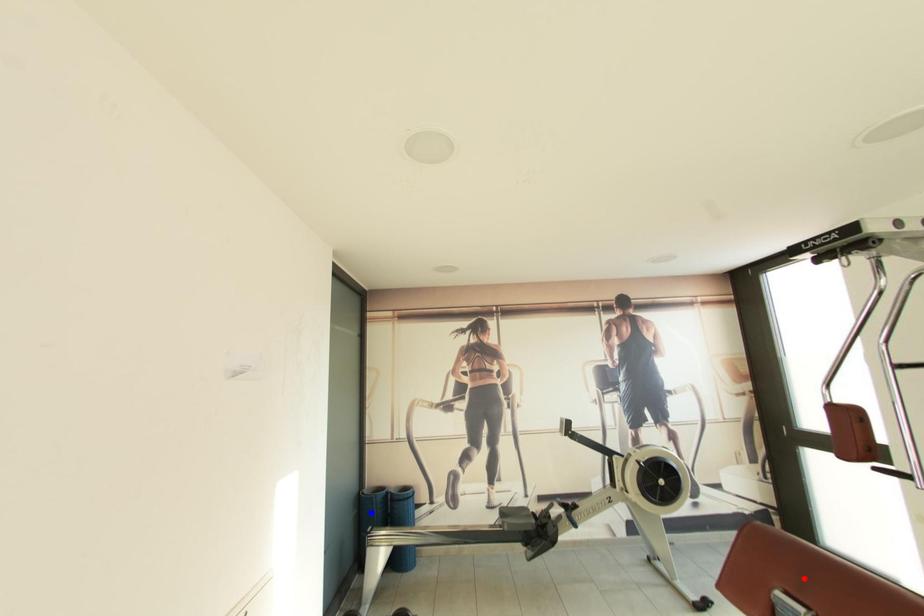
Question: Which of the two points in the image is closer to the camera?

Choices:
 (A) Blue point is closer.
 (B) Red point is closer.

Answer: (B)